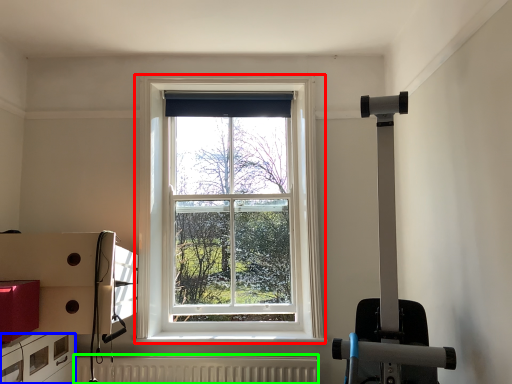
Question: Estimate the real-world distances between objects in this image. Which object is closer to window (highlighted by a red box), drawer (highlighted by a blue box) or radiator (highlighted by a green box)?

Choices:
 (A) drawer
 (B) radiator

Answer: (B)